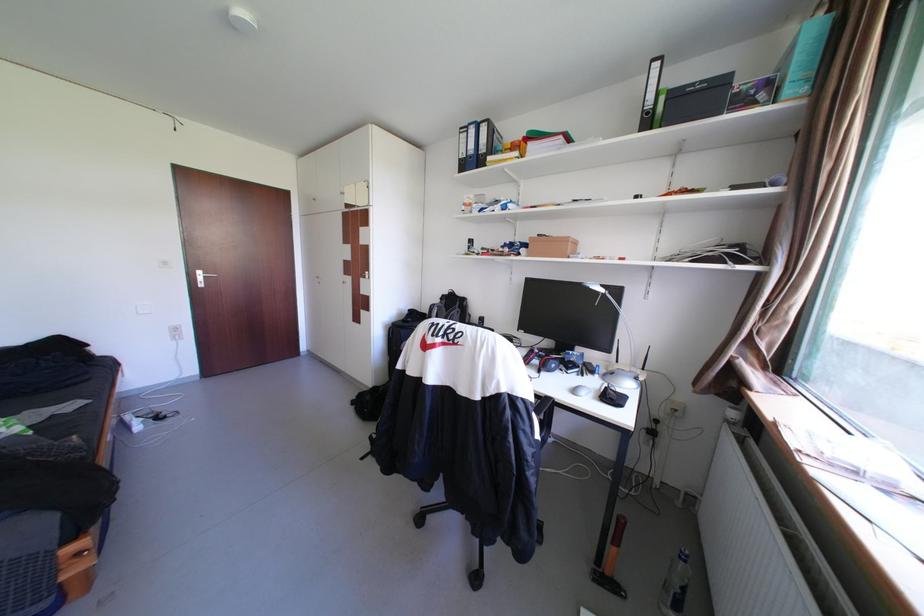
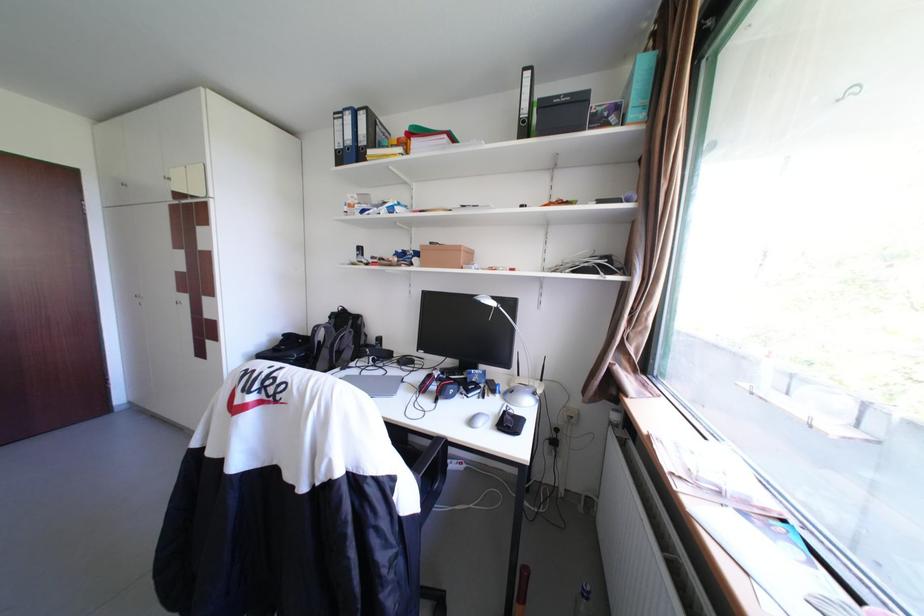
In the second image, find the point that corresponds to (589,286) in the first image.

(480, 301)